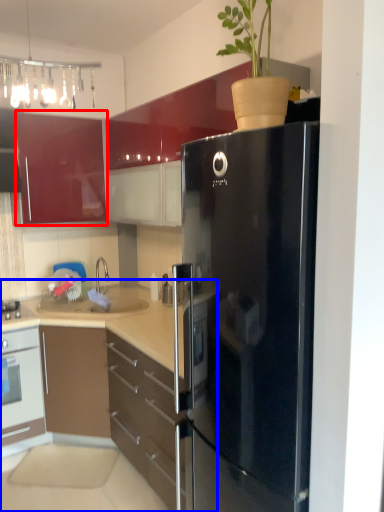
Question: Among these objects, which one is farthest to the camera, cabinetry (highlighted by a red box) or cabinetry (highlighted by a blue box)?

Choices:
 (A) cabinetry
 (B) cabinetry

Answer: (A)